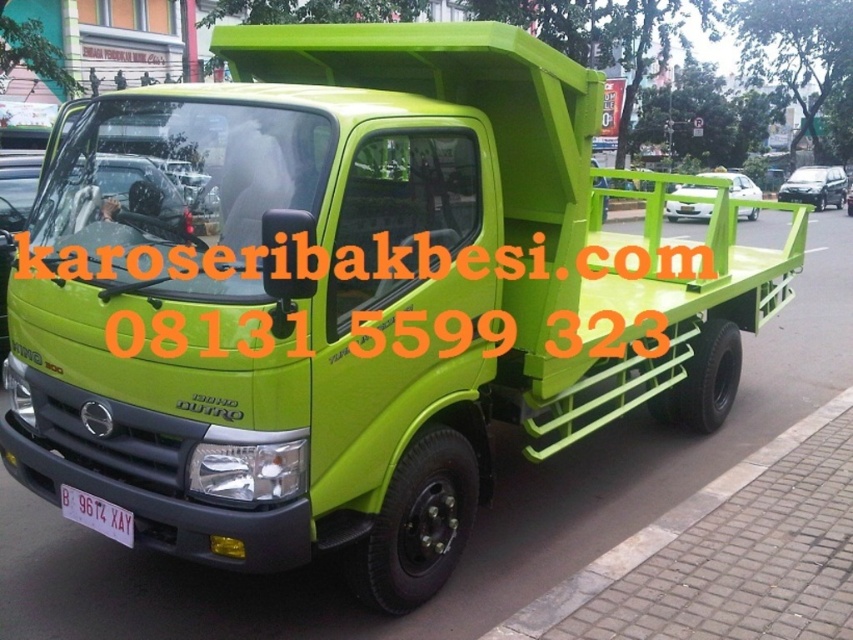
Which is more to the right, white plastic license plate at center or green matte truck at center?

From the viewer's perspective, green matte truck at center appears more on the right side.

Does white plastic license plate at center have a larger size compared to green matte truck at center?

Actually, white plastic license plate at center might be smaller than green matte truck at center.

Does point (91, 496) lie behind point (828, 179)?

That is False.

Where is `white plastic license plate at center`? The height and width of the screenshot is (640, 853). white plastic license plate at center is located at coordinates (97, 515).

Which is more to the right, matte green truck at center or green matte truck at center?

Positioned to the right is green matte truck at center.

Identify the location of matte green truck at center. This screenshot has width=853, height=640. (735, 184).

Image resolution: width=853 pixels, height=640 pixels. What do you see at coordinates (735, 184) in the screenshot?
I see `matte green truck at center` at bounding box center [735, 184].

Locate an element on the screen. Image resolution: width=853 pixels, height=640 pixels. matte green truck at center is located at coordinates (735, 184).

Is white plastic license plate at center bigger than matte green truck at center?

No, white plastic license plate at center is not bigger than matte green truck at center.

Which of these two, white plastic license plate at center or matte green truck at center, stands taller?

matte green truck at center is taller.

You are a GUI agent. You are given a task and a screenshot of the screen. Output one action in this format:
    pyautogui.click(x=<x>, y=<y>)
    Task: Click on the white plastic license plate at center
    The width and height of the screenshot is (853, 640).
    Given the screenshot: What is the action you would take?
    pyautogui.click(x=97, y=515)